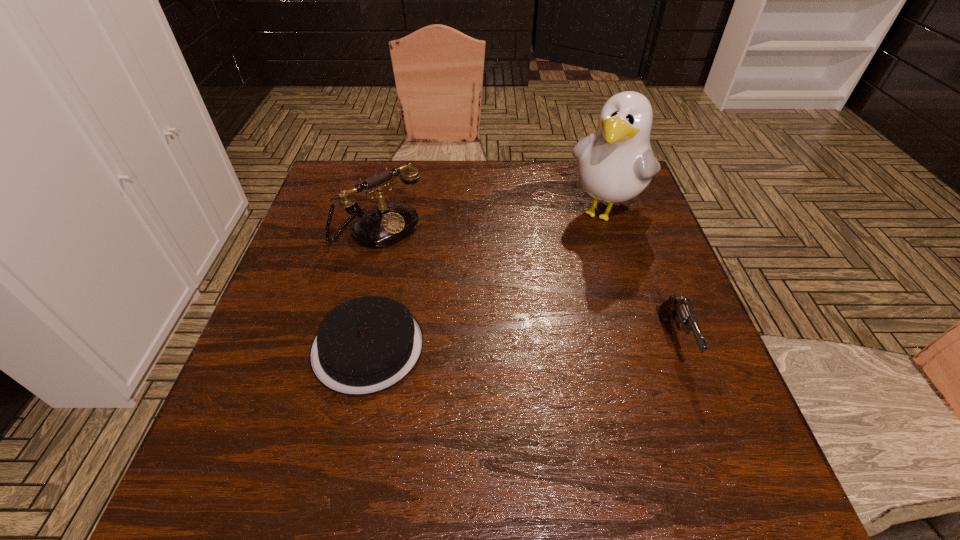
Identify the location of empty space between the shortest object and the third tallest object. The image size is (960, 540). (521, 345).

What are the coordinates of `free spot between the shortest object and the gull` in the screenshot? It's located at (487, 279).

Where is `vacant space that is in between the pancake and the tallest object`? The height and width of the screenshot is (540, 960). vacant space that is in between the pancake and the tallest object is located at coordinates (487, 279).

Where is `free spot between the third shortest object and the second shortest object`? This screenshot has width=960, height=540. free spot between the third shortest object and the second shortest object is located at coordinates (527, 285).

Where is `free space between the pancake and the third tallest object`? This screenshot has height=540, width=960. free space between the pancake and the third tallest object is located at coordinates (521, 345).

I want to click on vacant space in between the pistol and the telephone, so click(x=527, y=285).

I want to click on object that is the third closest to the tallest object, so click(x=366, y=345).

This screenshot has height=540, width=960. Find the location of `object that is the closest one to the shortest object`. object that is the closest one to the shortest object is located at coordinates (387, 224).

Find the location of a particular element. This screenshot has width=960, height=540. free point that satisfies the following two spatial constraints: 1. on the back side of the pancake; 2. on the left side of the gull is located at coordinates (397, 211).